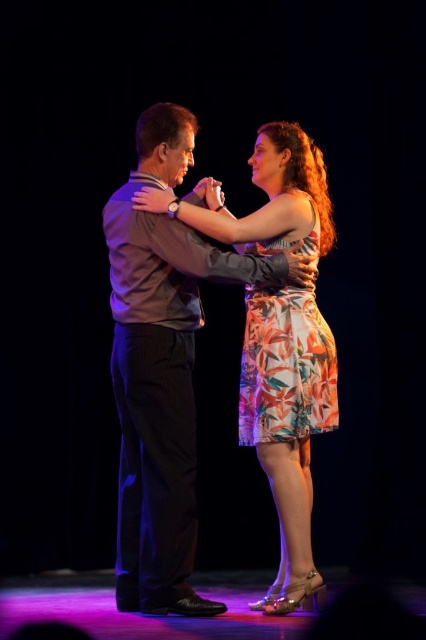
Is floral dress at center positioned in front of floral print dress at center?

Yes.

Based on the photo, can you confirm if floral dress at center is positioned to the right of floral print dress at center?

In fact, floral dress at center is to the left of floral print dress at center.

Locate an element on the screen. Image resolution: width=426 pixels, height=640 pixels. floral dress at center is located at coordinates tap(287, 422).

This screenshot has height=640, width=426. Identify the location of floral dress at center. (287, 422).